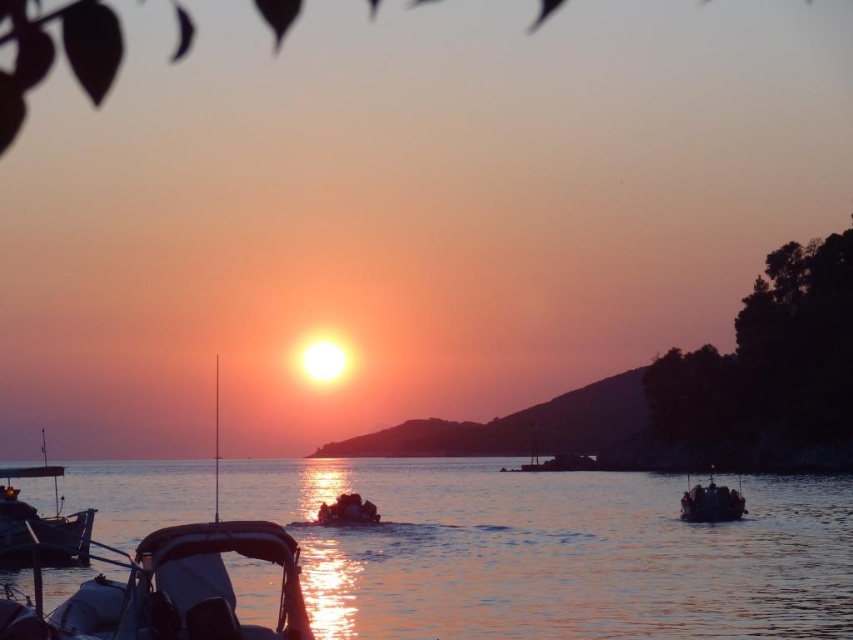
Question: Based on their relative distances, which object is farther from the white matte boat at center?

Choices:
 (A) matte black boat at lower left
 (B) glistening water at center

Answer: (B)

Question: Where is glistening water at center located in relation to metallic blue boat at center in the image?

Choices:
 (A) right
 (B) left

Answer: (B)

Question: Which point is closer to the camera?

Choices:
 (A) glistening water at center
 (B) white matte boat at center

Answer: (B)

Question: Is white matte boat at center thinner than matte black boat at lower left?

Choices:
 (A) yes
 (B) no

Answer: (B)

Question: Is glistening water at center wider than matte black boat at lower left?

Choices:
 (A) yes
 (B) no

Answer: (A)

Question: Which is nearer to the matte black boat at lower left?

Choices:
 (A) metallic blue boat at center
 (B) glistening water at center
 (C) white matte boat at center

Answer: (A)